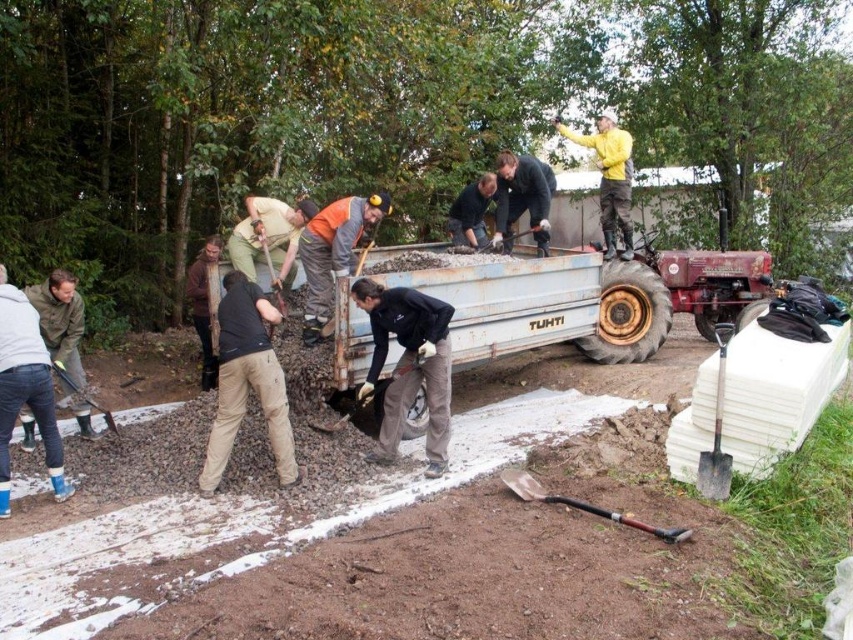
You are a worker at the construction site and need to choose a shovel to move the gravel pile. Which shovel, the black plastic shovel at lower center or the black rubber shovel at lower center, is bigger in size?

The black plastic shovel at lower center is larger in size than the black rubber shovel at lower center, so you should choose the black plastic shovel at lower center.

What is the location of the point with coordinates (583, 506) in the image?

The point with coordinates (583, 506) is located on the black plastic shovel at lower center.